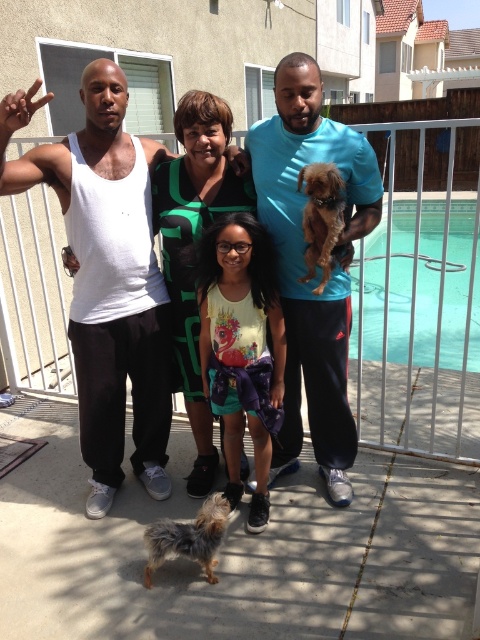
You are planning to place a small bench between the fluffy brown dog at lower left and the brown furry dog at center. Based on their widths, will the bench fit if it requires a space of 1 meter?

The fluffy brown dog at lower left might be wider than brown furry dog at center, so the total width required for both dogs could exceed 1 meter. Therefore, the bench may not fit comfortably between them.

You are a photographer trying to capture a photo of the blue cotton shirt at center and the yellow printed tank top at center. Which one is positioned to the right side of the other?

The blue cotton shirt at center is to the right of yellow printed tank top at center.

You are standing at the point marked by the coordinates point (x=304, y=266). Looking around, you see a blue cotton shirt at center. Which direction should you face to see the blue cotton shirt at center?

You are already facing the blue cotton shirt at center because the point (x=304, y=266) marks its location.